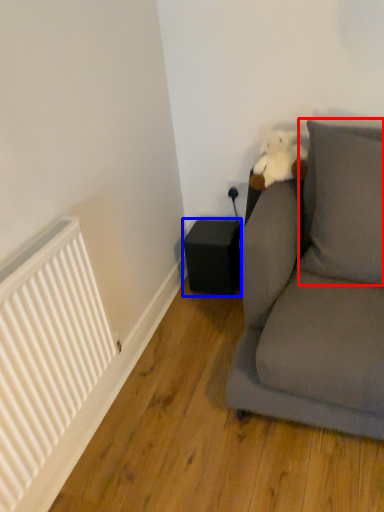
Question: Which of the following is the closest to the observer, pillow (highlighted by a red box) or speaker (highlighted by a blue box)?

Choices:
 (A) pillow
 (B) speaker

Answer: (A)